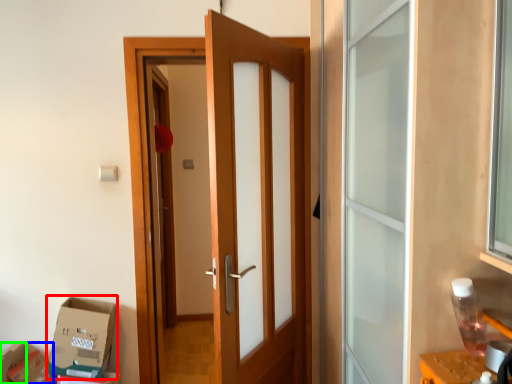
Question: Which object is the closest to the cardboard box (highlighted by a red box)? Choose among these: cardboard box (highlighted by a blue box) or box (highlighted by a green box).

Choices:
 (A) cardboard box
 (B) box

Answer: (A)